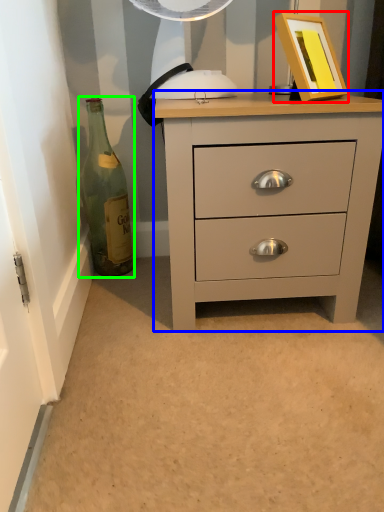
Question: Estimate the real-world distances between objects in this image. Which object is closer to picture frame (highlighted by a red box), chest of drawers (highlighted by a blue box) or bottle (highlighted by a green box)?

Choices:
 (A) chest of drawers
 (B) bottle

Answer: (A)